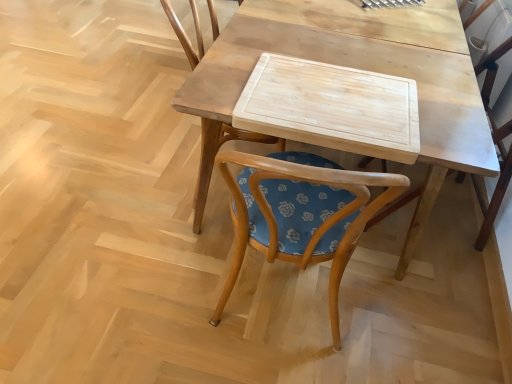
This screenshot has height=384, width=512. In order to click on free space to the left of wooden chair at center, the second chair viewed from the right in this screenshot , I will do `click(129, 178)`.